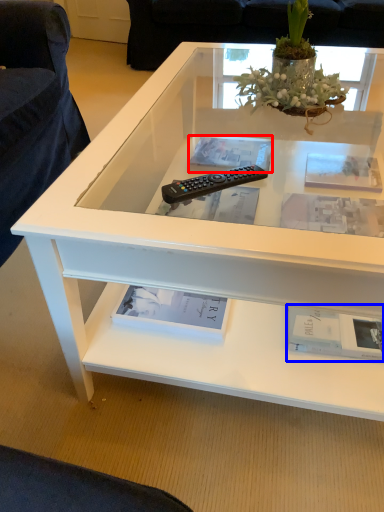
Question: Among these objects, which one is nearest to the camera, book (highlighted by a red box) or book (highlighted by a blue box)?

Choices:
 (A) book
 (B) book

Answer: (B)